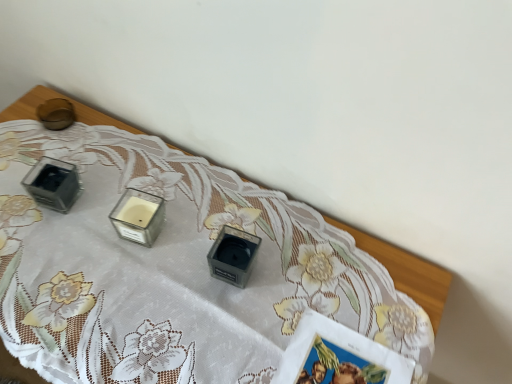
Where is `free area behind clear glass candle at center`? The image size is (512, 384). free area behind clear glass candle at center is located at coordinates (146, 165).